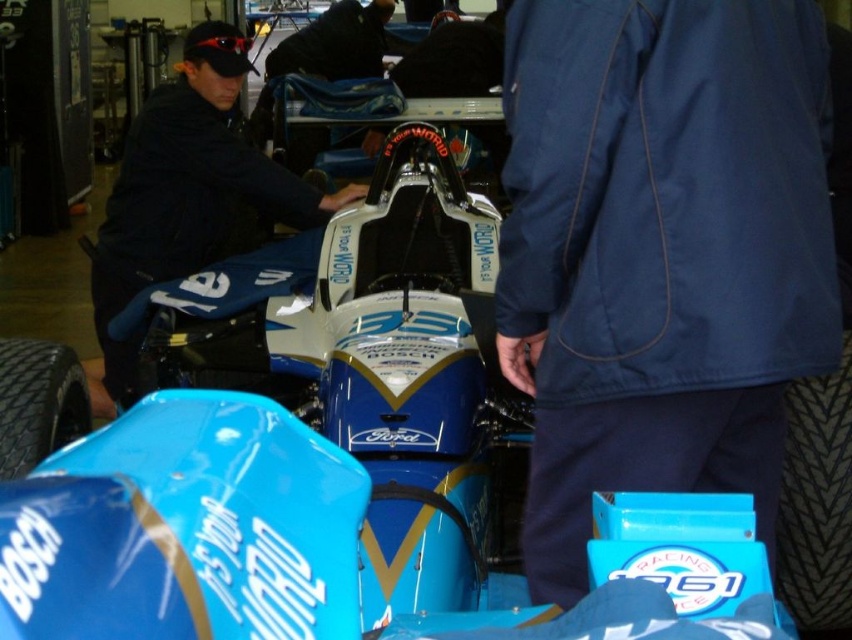
You are a team member in the garage and need to identify which jacket is smaller. You see the navy blue jacket at center and the dark blue jacket at center. Which one takes up less space?

The navy blue jacket at center occupies less space than the dark blue jacket at center, so the navy blue jacket at center is the smaller one.

You are a race engineer in the pit stop area. You need to locate the navy blue jacket at center. Where exactly is it located on the coordinate system?

The navy blue jacket at center is located at coordinate point (660, 252).

You are a mechanic in the garage and need to reach both the point at coordinates point (712, 195) and point (199, 140) on the race car. Which point should you reach first to work on the closer one?

You should reach point (712, 195) first because it is closer to the viewer than point (199, 140).